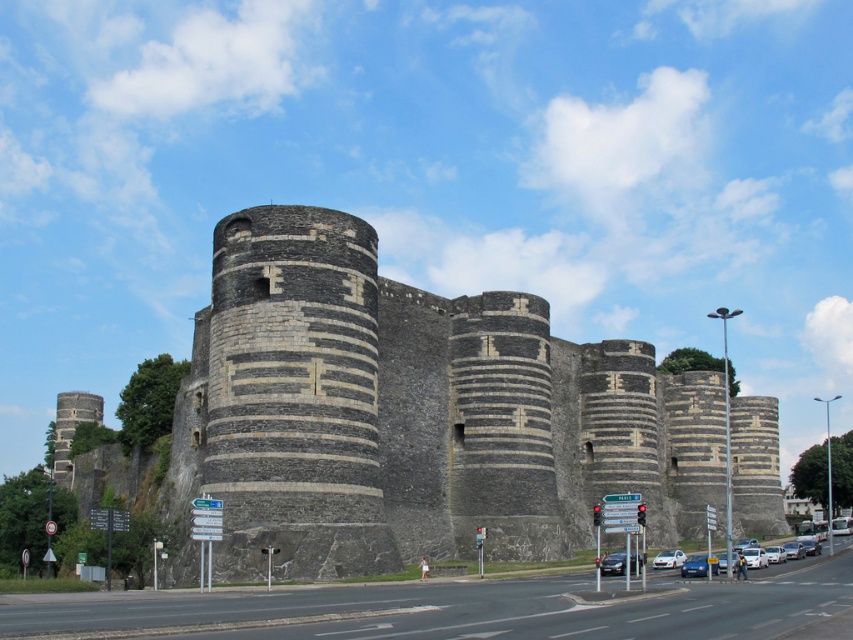
Question: Can you confirm if blue metallic car at center is wider than white glossy sedan at center?

Choices:
 (A) yes
 (B) no

Answer: (A)

Question: Does gray stone castle at center have a lesser width compared to shiny black sedan at center?

Choices:
 (A) yes
 (B) no

Answer: (B)

Question: Which point is farther from the camera taking this photo?

Choices:
 (A) (682, 554)
 (B) (199, 406)
 (C) (701, 572)

Answer: (A)

Question: Which point is farther to the camera?

Choices:
 (A) (683, 564)
 (B) (279, 241)
 (C) (660, 557)
 (D) (639, 563)

Answer: (C)

Question: Is gray stone castle at center positioned at the back of white glossy sedan at center?

Choices:
 (A) no
 (B) yes

Answer: (A)

Question: Which point is closer to the camera?

Choices:
 (A) (619, 554)
 (B) (704, 576)

Answer: (B)